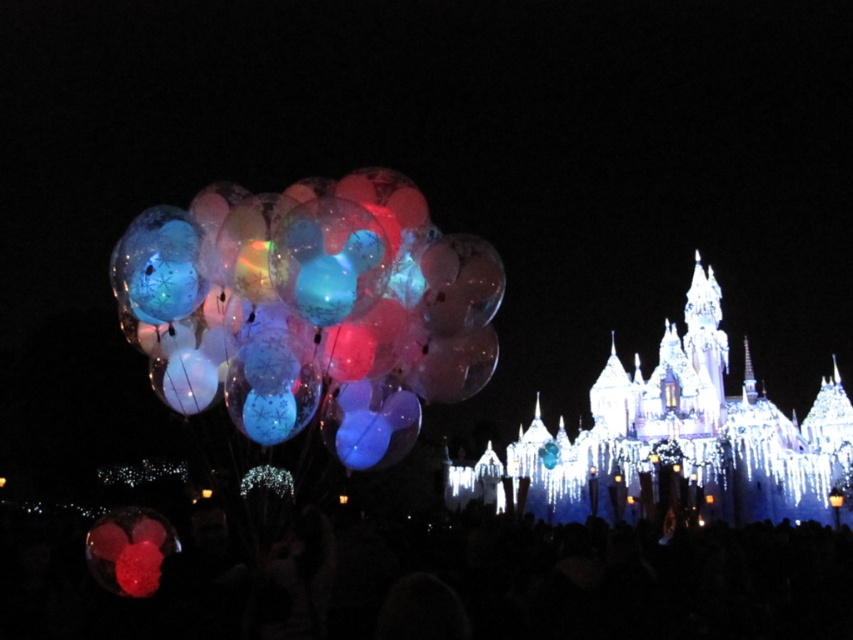
Based on the photo, you are standing at the entrance of the theme park and see the festive scene with the illuminated balloons and the castle. There is a point at coordinates point (141,316) that you want to reach. Can you estimate how far you need to walk to reach that point?

The distance of point (141,316) from viewer is 363.35 feet, so you need to walk approximately 363.35 feet to reach that point.

You are a visitor at the event and want to take a photo of both the illuminated castle at center and the illuminated glass castle at center. Which one should you point your camera upwards to capture?

You should point your camera upwards to capture the illuminated castle at center because it is positioned above the illuminated glass castle at center.

You are standing at the point closest to the castle in the image. Which of the two points, point (552,449) or point (662,408), is farther away from you?

Point (552,449) is behind point (662,408), so it is farther away from you.